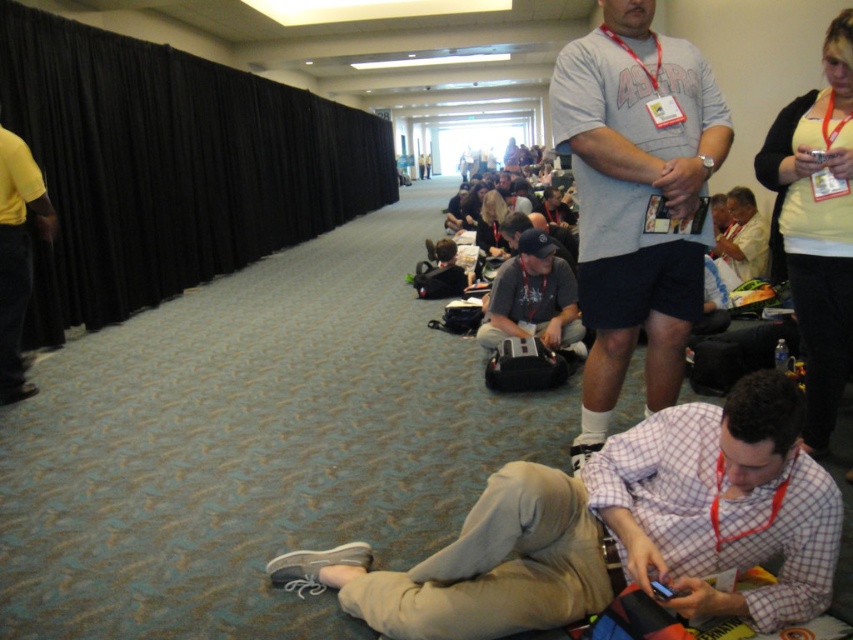
You are standing at the position of point (747, 248) and want to walk to the stage area behind the black curtain on the left. There is a point at (486, 316) in your path. Will you need to go around it or can you walk straight to the stage?

Since point (486, 316) is in front of point (747, 248), you will need to go around it to reach the stage area behind the black curtain on the left.

You are standing in the convention center and want to reach a specific point marked at coordinates point (563, 531). If you are currently 2 meters away from this point, how much further do you need to walk to reach it?

The distance of point (563, 531) from viewer is 1.84 meters, so you are already closer than the 2 meters mentioned. You need to walk 0.16 meters less to reach it.